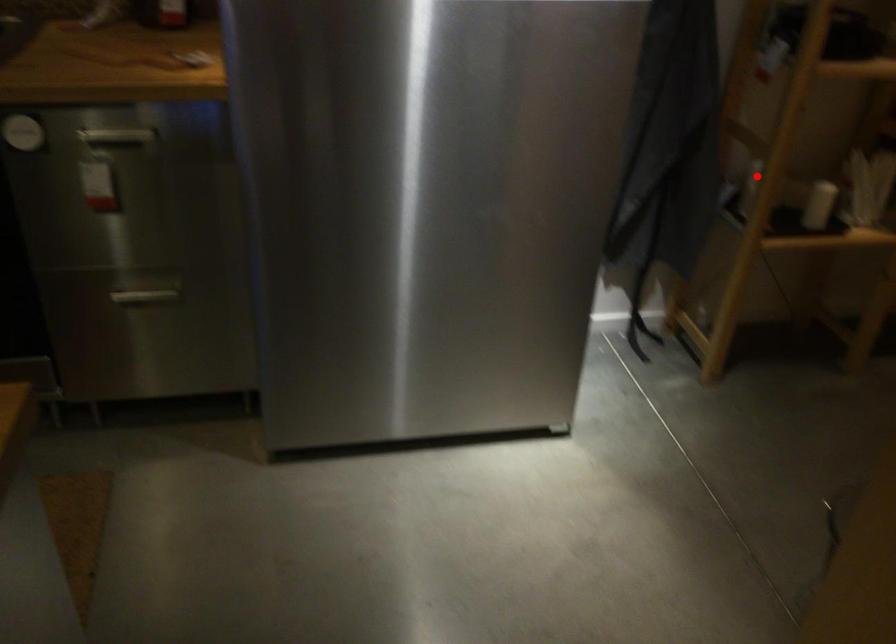
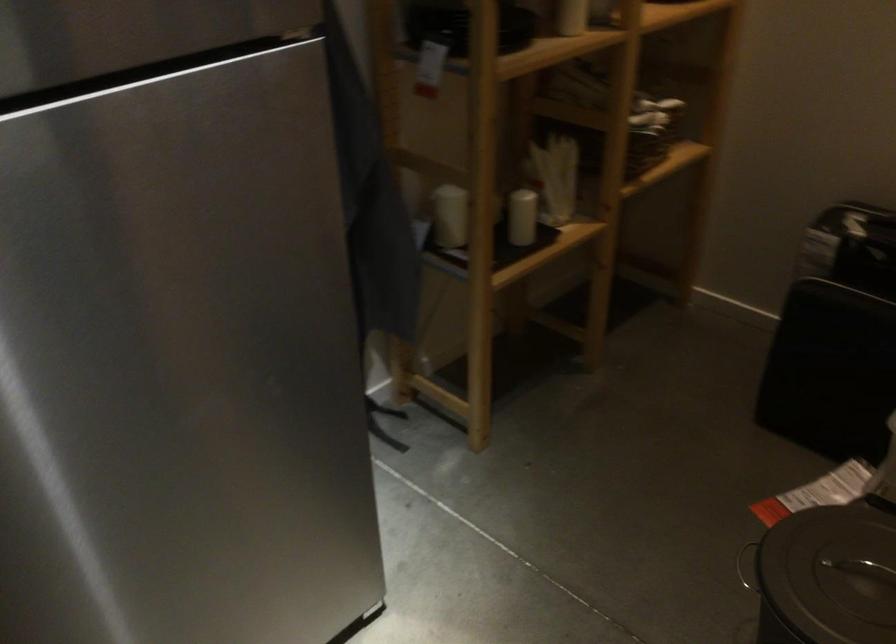
Question: I am providing you with two images of the same scene from different viewpoints. Image1 has a red point marked. In image2, the corresponding 3D location appears at what relative position? Reply with the corresponding letter.

Choices:
 (A) Closer
 (B) Farther

Answer: (A)